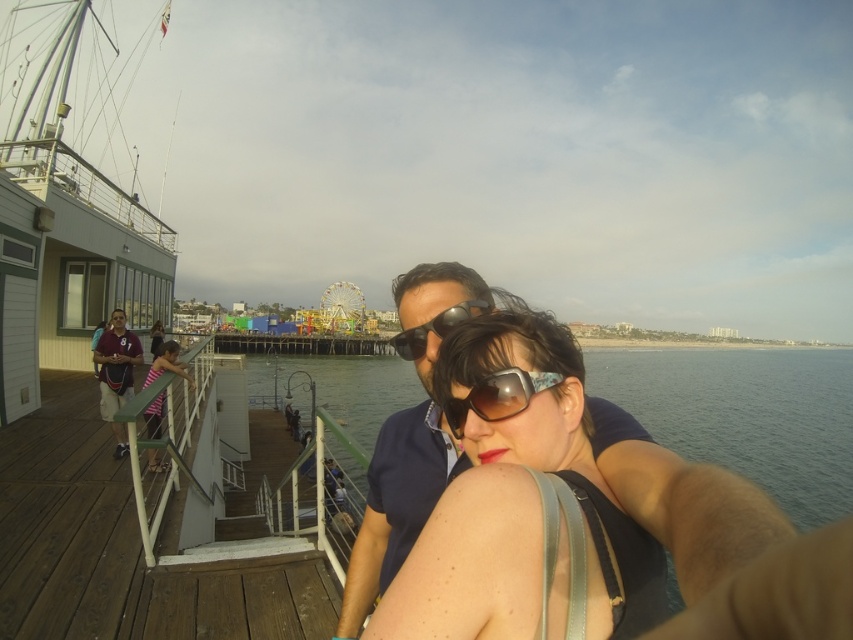
Does brown wooden deck at lower left lie behind black plastic sunglasses at center?

No, it is not.

Describe the element at coordinates (123, 547) in the screenshot. I see `brown wooden deck at lower left` at that location.

Where is `brown wooden deck at lower left`? The height and width of the screenshot is (640, 853). brown wooden deck at lower left is located at coordinates (123, 547).

How much distance is there between brown wooden deck at lower left and clear blue water at center?

brown wooden deck at lower left is 127.16 meters from clear blue water at center.

From the picture: Does brown wooden deck at lower left appear over clear blue water at center?

Indeed, brown wooden deck at lower left is positioned over clear blue water at center.

Is point (78, 528) farther from viewer compared to point (614, 388)?

No, it is in front of (614, 388).

This screenshot has width=853, height=640. What are the coordinates of `brown wooden deck at lower left` in the screenshot? It's located at (123, 547).

Is matte blue shirt at left to the right of black plastic sunglasses at center from the viewer's perspective?

Incorrect, matte blue shirt at left is not on the right side of black plastic sunglasses at center.

This screenshot has height=640, width=853. What do you see at coordinates (115, 372) in the screenshot? I see `matte blue shirt at left` at bounding box center [115, 372].

Does point (105, 404) lie in front of point (402, 336)?

No, it is not.

Find the location of a particular element. The image size is (853, 640). matte blue shirt at left is located at coordinates (115, 372).